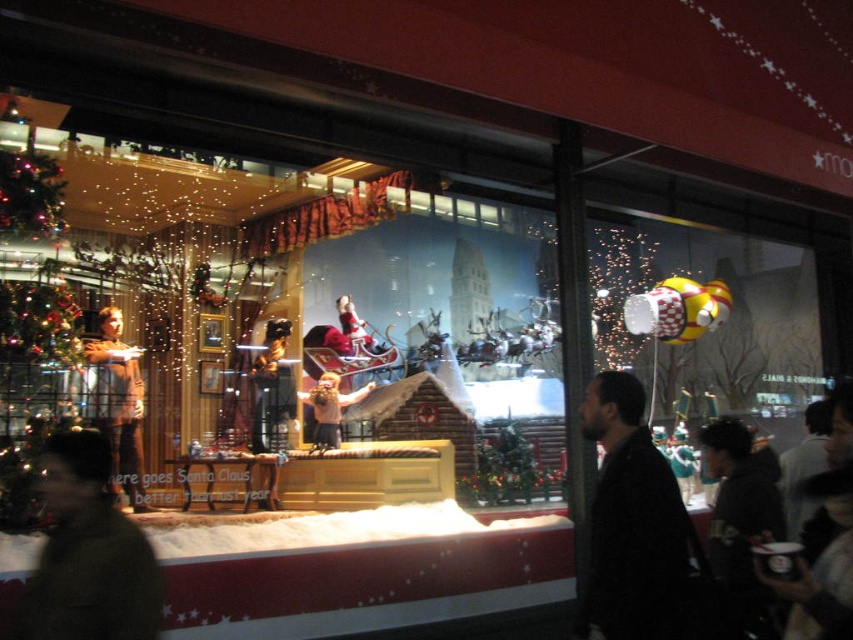
You are a customer browsing the holiday window display and notice two jackets. The first is the matte brown jacket at left, and the second is the brown leather jacket at center. Which jacket is positioned higher in the display?

The matte brown jacket at left is positioned higher in the display than the brown leather jacket at center because it is above it.

You are a customer looking at the festive holiday window display. You see the green wool coat at lower left and the brown leather jacket at center. Which one is positioned lower in the display?

The green wool coat at lower left is positioned lower than the brown leather jacket at center.

You are a store employee who needs to arrange two coats in the holiday window display. The green wool coat at lower left and the brown leather jacket at center are currently 2.72 meters apart. If you want to place them closer together so that there is only 1.5 meters between them, which direction should you move one of the coats? Please specify which coat to move and the direction.

To reduce the distance between the green wool coat at lower left and the brown leather jacket at center from 2.72 meters to 1.5 meters, you should move the brown leather jacket at center towards the green wool coat at lower left. Alternatively, moving the green wool coat at lower left towards the brown leather jacket at center would also work. Either direction would effectively decrease the distance between them.